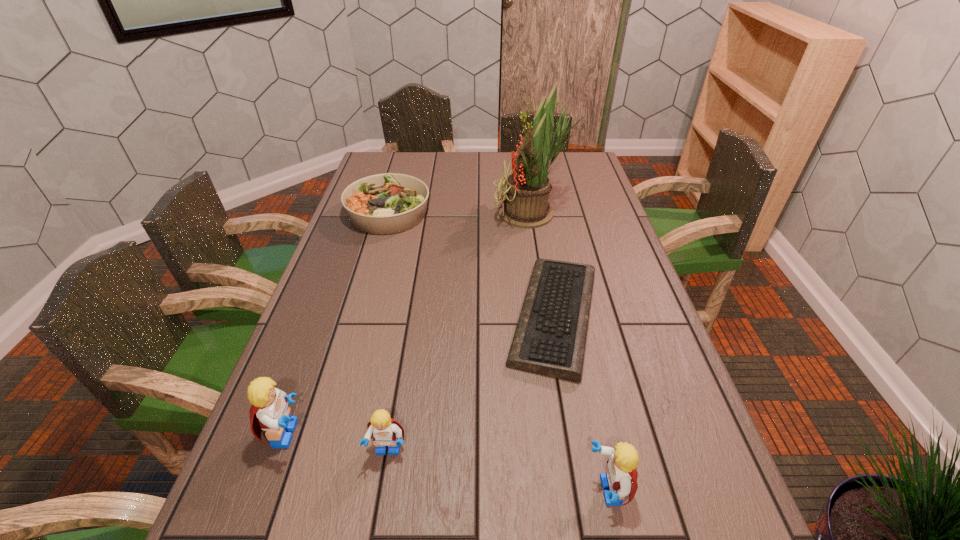
Locate an element on the screen. The height and width of the screenshot is (540, 960). the leftmost Lego is located at coordinates (270, 412).

I want to click on the shortest Lego, so click(x=386, y=431).

I want to click on the second Lego from left to right, so click(386, 431).

Where is `the second shortest Lego`? The width and height of the screenshot is (960, 540). the second shortest Lego is located at coordinates (621, 475).

Locate an element on the screen. the rightmost Lego is located at coordinates (621, 475).

The width and height of the screenshot is (960, 540). What are the coordinates of `the tallest object` in the screenshot? It's located at (527, 189).

You are a GUI agent. You are given a task and a screenshot of the screen. Output one action in this format:
    pyautogui.click(x=<x>, y=<y>)
    Task: Click on the computer keyboard
    
    Given the screenshot: What is the action you would take?
    pyautogui.click(x=550, y=338)

Where is `the shortest object`? the shortest object is located at coordinates (550, 338).

You are a GUI agent. You are given a task and a screenshot of the screen. Output one action in this format:
    pyautogui.click(x=<x>, y=<y>)
    Task: Click on the salad plate
    Image resolution: width=960 pixels, height=540 pixels.
    Given the screenshot: What is the action you would take?
    pyautogui.click(x=389, y=203)

Find the location of a particular element. The image size is (960, 540). vacant space situated 0.170m on the front-facing side of the leftmost Lego is located at coordinates (393, 434).